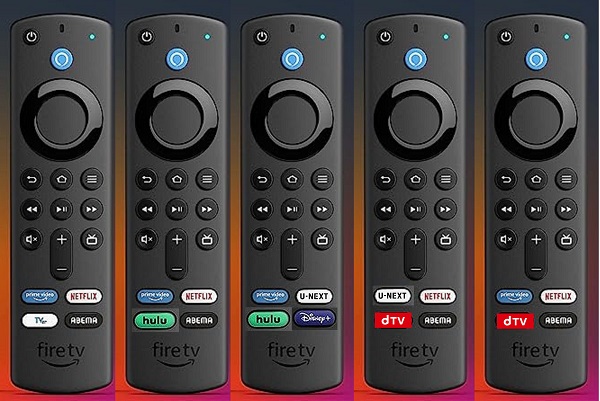
This screenshot has width=600, height=401. I want to click on remote control lights, so click(x=90, y=32), click(x=207, y=35), click(x=322, y=35), click(x=447, y=35), click(x=566, y=34).